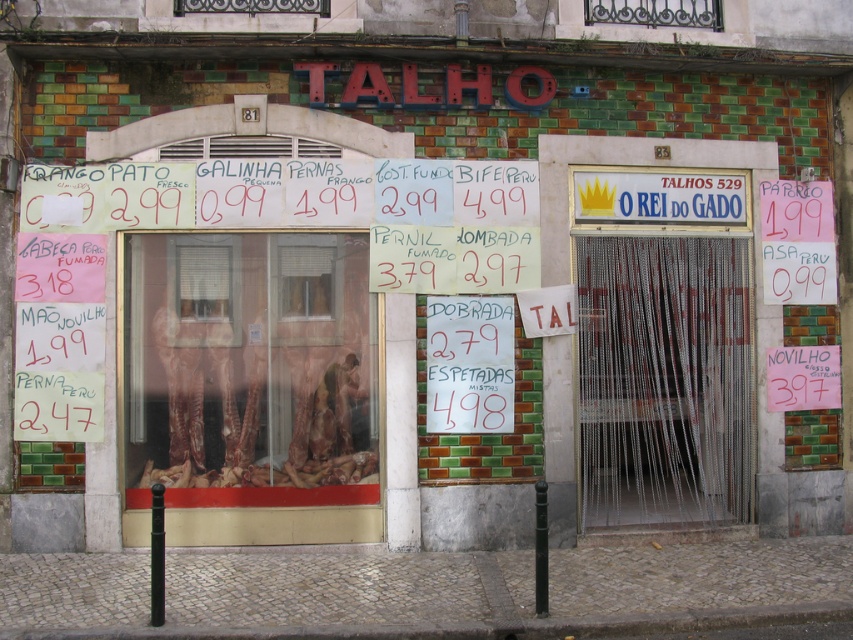
structural integrity is a concern for the building. The metallic wrought iron at upper center and metallic glass window at upper center are both part of the storefront. Which one is more likely to withstand strong winds?

structural integrity is a concern for the building. The metallic wrought iron at upper center and metallic glass window at upper center are both part of the storefront. Which one is more likely to withstand strong winds? The metallic wrought iron at upper center is larger in size than metallic glass window at upper center, so it is more likely to withstand strong winds due to its larger size providing better structural support.

You are standing at the entrance of the TALHO butcher shop. You want to take a photo of the price tags displayed outside the window and on the wall. The camera you are using has a focal length of 50mm and a sensor size of 24mm x 36mm. The point where the price tags are located is at coordinate point(712, 13). To ensure the price tags are in focus, what is the minimum distance in meters you need to be from the price tags?

The point at coordinate(712, 13) is 9.30 meters away from the camera. Therefore, to ensure the price tags are in focus, you need to be at least 9.30 meters away from the price tags.

You are a customer standing in front of the TALHO butcher shop. You notice the metallic wrought iron at upper center and the metallic glass window at upper center. Which object is closer to you?

The metallic wrought iron at upper center is closer to you because it is further to the viewer than the metallic glass window at upper center.